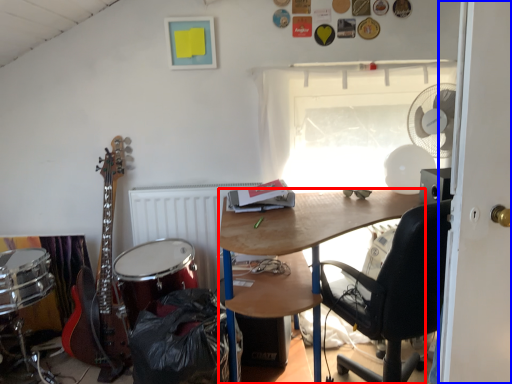
Question: Which of the following is the closest to the observer, desk (highlighted by a red box) or door (highlighted by a blue box)?

Choices:
 (A) desk
 (B) door

Answer: (B)